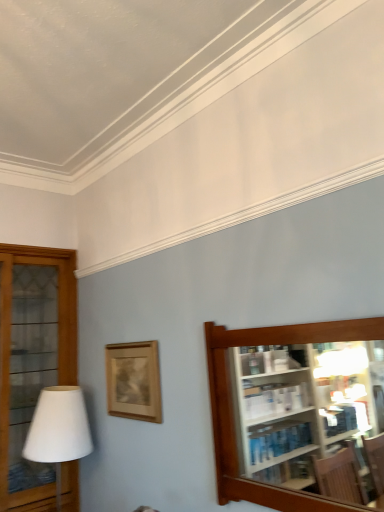
Question: Is wooden glass cabinet at left, placed as the 2th shelf when sorted from front to back, positioned beyond the bounds of wooden picture frame at center?

Choices:
 (A) yes
 (B) no

Answer: (A)

Question: Does wooden glass cabinet at left, placed as the 2th shelf when sorted from front to back, appear on the left side of wooden picture frame at center?

Choices:
 (A) no
 (B) yes

Answer: (B)

Question: From the image's perspective, is wooden glass cabinet at left, placed as the 2th shelf when sorted from front to back, beneath wooden picture frame at center?

Choices:
 (A) no
 (B) yes

Answer: (B)

Question: Considering the relative sizes of wooden glass cabinet at left, the second shelf from the right, and wooden picture frame at center in the image provided, is wooden glass cabinet at left, the second shelf from the right, thinner than wooden picture frame at center?

Choices:
 (A) yes
 (B) no

Answer: (B)

Question: Considering the relative sizes of wooden glass cabinet at left, the second shelf from the right, and wooden picture frame at center in the image provided, is wooden glass cabinet at left, the second shelf from the right, taller than wooden picture frame at center?

Choices:
 (A) yes
 (B) no

Answer: (A)

Question: Is white matte table lamp at left bigger or smaller than brown wooden shelf at right, acting as the first shelf starting from the front?

Choices:
 (A) small
 (B) big

Answer: (B)

Question: Is point (39, 410) closer or farther from the camera than point (274, 501)?

Choices:
 (A) farther
 (B) closer

Answer: (A)

Question: From a real-world perspective, is white matte table lamp at left positioned above or below brown wooden shelf at right, acting as the first shelf starting from the front?

Choices:
 (A) below
 (B) above

Answer: (A)

Question: Considering the positions of white matte table lamp at left and brown wooden shelf at right, marked as the second shelf in a back-to-front arrangement, in the image, is white matte table lamp at left taller or shorter than brown wooden shelf at right, marked as the second shelf in a back-to-front arrangement,?

Choices:
 (A) tall
 (B) short

Answer: (A)

Question: From the image's perspective, is white matte table lamp at left positioned above or below wooden glass cabinet at left, placed as the 2th shelf when sorted from front to back?

Choices:
 (A) below
 (B) above

Answer: (A)

Question: Is white matte table lamp at left inside or outside of wooden glass cabinet at left, the second shelf from the right?

Choices:
 (A) inside
 (B) outside

Answer: (B)

Question: Based on their positions, is white matte table lamp at left located to the left or right of wooden glass cabinet at left, positioned as the 1th shelf in left-to-right order?

Choices:
 (A) left
 (B) right

Answer: (B)

Question: Considering their positions, is white matte table lamp at left located in front of or behind wooden glass cabinet at left, the second shelf from the right?

Choices:
 (A) front
 (B) behind

Answer: (A)

Question: Is wooden glass cabinet at left, acting as the first shelf starting from the back, inside or outside of wooden picture frame at center?

Choices:
 (A) outside
 (B) inside

Answer: (A)

Question: In terms of height, does wooden glass cabinet at left, positioned as the 1th shelf in left-to-right order, look taller or shorter compared to wooden picture frame at center?

Choices:
 (A) tall
 (B) short

Answer: (A)